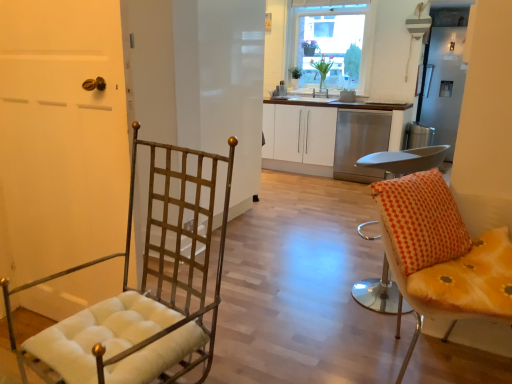
Find the location of a particular element. This screenshot has width=512, height=384. vacant space situated on the left part of orange fabric cushioned stool at right, arranged as the 2th chair when viewed from the right is located at coordinates (317, 287).